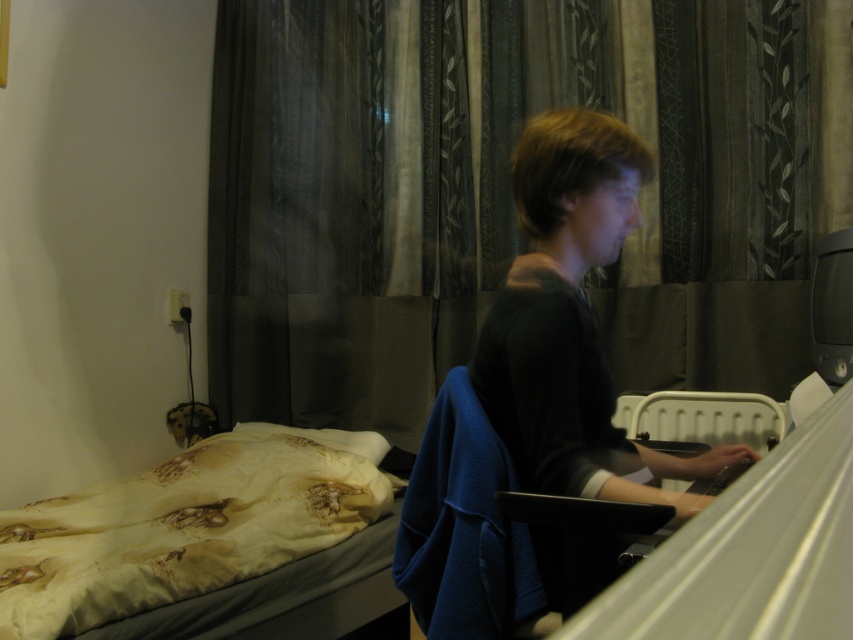
Question: Does dark gray sheer curtain at center have a lesser width compared to printed fabric bed at lower left?

Choices:
 (A) yes
 (B) no

Answer: (B)

Question: Which point is closer to the camera?

Choices:
 (A) printed fabric bed at lower left
 (B) dark gray sheer curtain at center

Answer: (A)

Question: Is printed fabric bed at lower left further to camera compared to dark gray sweater at center?

Choices:
 (A) no
 (B) yes

Answer: (B)

Question: Among these points, which one is nearest to the camera?

Choices:
 (A) (258, 456)
 (B) (514, 275)

Answer: (B)

Question: Which object appears farthest from the camera in this image?

Choices:
 (A) dark gray sheer curtain at center
 (B) dark gray sweater at center
 (C) printed fabric bed at lower left

Answer: (A)

Question: Does printed fabric bed at lower left have a greater width compared to dark gray sweater at center?

Choices:
 (A) no
 (B) yes

Answer: (B)